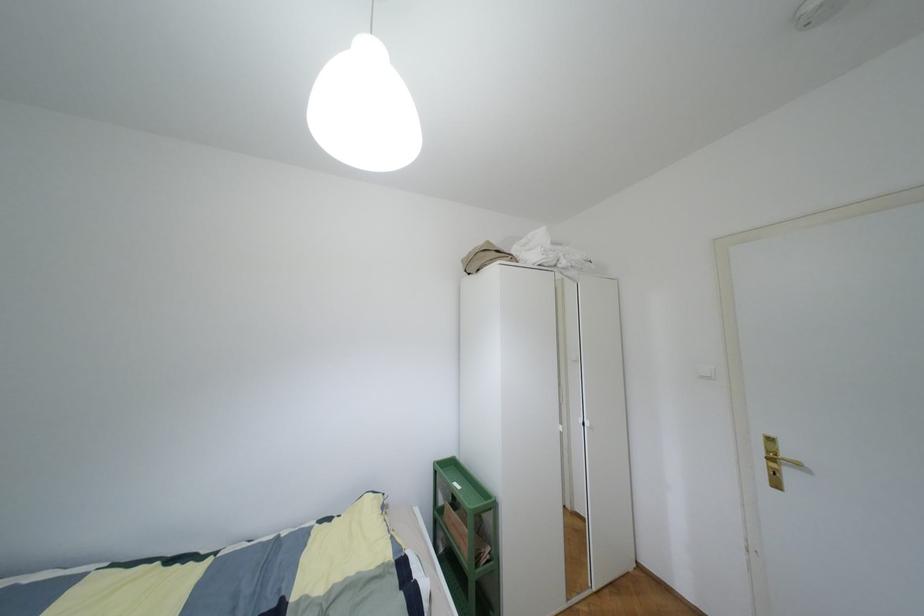
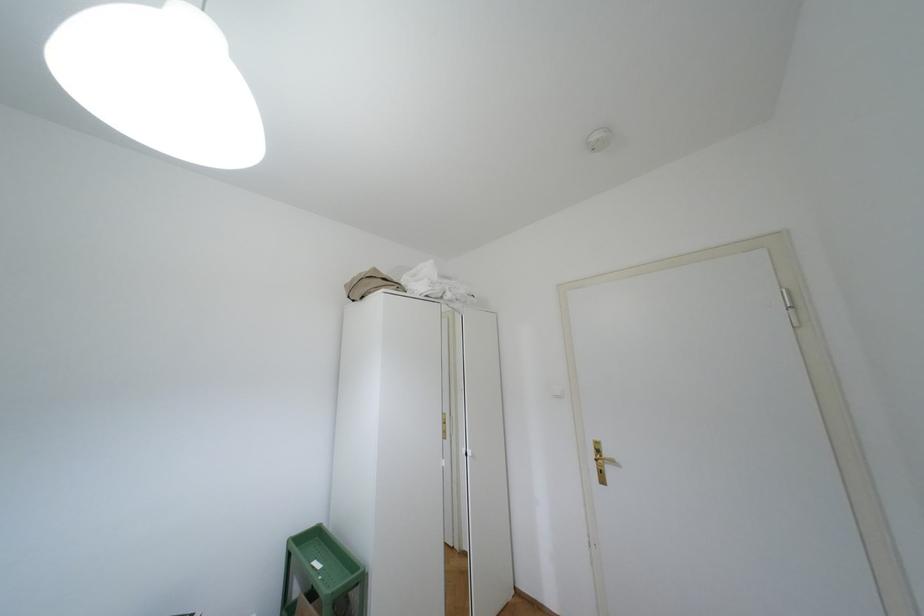
Find the pixel in the second image that matches (x=797, y=464) in the first image.

(612, 461)